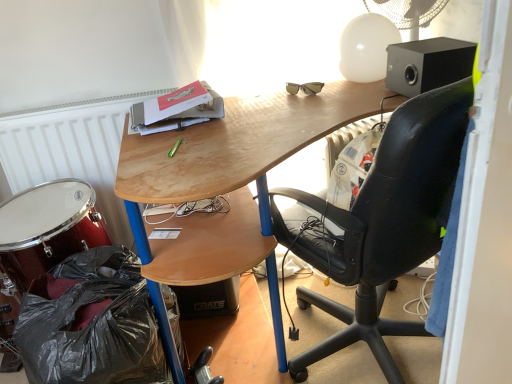
This screenshot has height=384, width=512. Find the location of `shiny red drum at lower left`. shiny red drum at lower left is located at coordinates (48, 228).

This screenshot has width=512, height=384. What do you see at coordinates (91, 323) in the screenshot?
I see `black plastic bag at lower left` at bounding box center [91, 323].

What is the approximate height of white plastic mechanical fan at upper right?

white plastic mechanical fan at upper right is 17.68 centimeters in height.

This screenshot has width=512, height=384. What do you see at coordinates (241, 144) in the screenshot?
I see `wooden desk at upper center` at bounding box center [241, 144].

Describe the element at coordinates (428, 64) in the screenshot. The height and width of the screenshot is (384, 512). I see `matte black speaker at upper right` at that location.

Describe the element at coordinates (381, 223) in the screenshot. The height and width of the screenshot is (384, 512). I see `black leather chair at upper right` at that location.

The height and width of the screenshot is (384, 512). I want to click on shiny red drum at lower left, so pyautogui.click(x=48, y=228).

How many degrees apart are the facing directions of matte black speaker at upper right and wooden desk at upper center?

They differ by 88.8 degrees in their facing directions.

Is matte black speaker at upper right inside the boundaries of wooden desk at upper center, or outside?

matte black speaker at upper right lies outside wooden desk at upper center.

Considering the relative sizes of matte black speaker at upper right and wooden desk at upper center in the image provided, is matte black speaker at upper right thinner than wooden desk at upper center?

Yes.

Which of these two, matte black speaker at upper right or wooden desk at upper center, is smaller?

matte black speaker at upper right.

Who is smaller, black leather chair at upper right or wooden desk at upper center?

black leather chair at upper right is smaller.

You are a GUI agent. You are given a task and a screenshot of the screen. Output one action in this format:
    pyautogui.click(x=<x>, y=<y>)
    Task: Click on the chair in front of the wooden desk at upper center
    This screenshot has height=384, width=512.
    Given the screenshot: What is the action you would take?
    pyautogui.click(x=381, y=223)

Is black leather chair at upper right thinner than wooden desk at upper center?

Indeed, black leather chair at upper right has a lesser width compared to wooden desk at upper center.

From the picture: Is wooden desk at upper center a part of white matte radiator at left?

No, white matte radiator at left does not contain wooden desk at upper center.

Locate an element on the screen. radiator above the wooden desk at upper center (from the image's perspective) is located at coordinates (71, 149).

In the scene shown: How different are the orientations of white matte radiator at left and wooden desk at upper center in degrees?

The facing directions of white matte radiator at left and wooden desk at upper center are 2.38 degrees apart.

This screenshot has width=512, height=384. I want to click on chair to the left of white plastic mechanical fan at upper right, so click(x=381, y=223).

Is white plastic mechanical fan at upper right shorter than black leather chair at upper right?

Indeed, white plastic mechanical fan at upper right has a lesser height compared to black leather chair at upper right.

Can you tell me how much white plastic mechanical fan at upper right and black leather chair at upper right differ in facing direction?

The angular difference between white plastic mechanical fan at upper right and black leather chair at upper right is 103 degrees.

From the image's perspective, between white plastic mechanical fan at upper right and black leather chair at upper right, which one is located above?

white plastic mechanical fan at upper right is shown above in the image.

Measure the distance from white matte radiator at left to white plastic mechanical fan at upper right.

white matte radiator at left and white plastic mechanical fan at upper right are 4.01 feet apart.

Considering the relative positions of white matte radiator at left and white plastic mechanical fan at upper right in the image provided, is white matte radiator at left behind white plastic mechanical fan at upper right?

Yes, white matte radiator at left is further from the viewer.

Based on the photo, from the image's perspective, is white matte radiator at left over white plastic mechanical fan at upper right?

No, from the image's perspective, white matte radiator at left is not over white plastic mechanical fan at upper right.

How different are the orientations of white matte radiator at left and white plastic mechanical fan at upper right in degrees?

They differ by 57.9 degrees in their facing directions.

Is shiny red drum at lower left at the back of matte black speaker at upper right?

No, matte black speaker at upper right is not facing away from shiny red drum at lower left.

In the scene shown: From a real-world perspective, who is located higher, matte black speaker at upper right or shiny red drum at lower left?

In real-world perspective, matte black speaker at upper right is above.

Considering the positions of objects matte black speaker at upper right and shiny red drum at lower left in the image provided, who is more to the left, matte black speaker at upper right or shiny red drum at lower left?

Positioned to the left is shiny red drum at lower left.

Could you tell me if white plastic mechanical fan at upper right is facing matte black speaker at upper right?

Yes, white plastic mechanical fan at upper right is oriented towards matte black speaker at upper right.

From a real-world perspective, who is located higher, white plastic mechanical fan at upper right or matte black speaker at upper right?

white plastic mechanical fan at upper right is physically above.

Between white plastic mechanical fan at upper right and matte black speaker at upper right, which one has less height?

With less height is matte black speaker at upper right.

Choose the correct answer: Is white plastic mechanical fan at upper right inside matte black speaker at upper right or outside it?

white plastic mechanical fan at upper right is not inside matte black speaker at upper right, it's outside.

This screenshot has width=512, height=384. In order to click on desk on the left of matte black speaker at upper right in this screenshot , I will do `click(241, 144)`.

Image resolution: width=512 pixels, height=384 pixels. I want to click on chair that appears on the right of wooden desk at upper center, so click(381, 223).

Which object lies further to the anchor point wooden desk at upper center, white plastic mechanical fan at upper right or shiny red drum at lower left?

white plastic mechanical fan at upper right.

Looking at the image, which one is located closer to white plastic mechanical fan at upper right, black leather chair at upper right or black plastic bag at lower left?

black leather chair at upper right lies closer to white plastic mechanical fan at upper right than the other object.

Estimate the real-world distances between objects in this image. Which object is closer to matte black speaker at upper right, white matte radiator at left or shiny red drum at lower left?

white matte radiator at left.

Estimate the real-world distances between objects in this image. Which object is further from shiny red drum at lower left, matte black speaker at upper right or white plastic mechanical fan at upper right?

Based on the image, white plastic mechanical fan at upper right appears to be further to shiny red drum at lower left.

Considering their positions, is white matte radiator at left positioned closer to white plastic mechanical fan at upper right than black plastic bag at lower left?

The object closer to white plastic mechanical fan at upper right is white matte radiator at left.

Consider the image. When comparing their distances from black plastic bag at lower left, does matte black speaker at upper right or black leather chair at upper right seem closer?

black leather chair at upper right.

Considering their positions, is white matte radiator at left positioned closer to shiny red drum at lower left than black plastic bag at lower left?

Based on the image, black plastic bag at lower left appears to be nearer to shiny red drum at lower left.

Based on their spatial positions, is white plastic mechanical fan at upper right or black plastic bag at lower left closer to white matte radiator at left?

Among the two, black plastic bag at lower left is located nearer to white matte radiator at left.

Identify the location of radiator between shiny red drum at lower left and matte black speaker at upper right in the horizontal direction. The width and height of the screenshot is (512, 384). (71, 149).

Identify the location of desk that lies between white plastic mechanical fan at upper right and black plastic bag at lower left from top to bottom. (241, 144).

Where is `desk between shiny red drum at lower left and white plastic mechanical fan at upper right from left to right`? The height and width of the screenshot is (384, 512). desk between shiny red drum at lower left and white plastic mechanical fan at upper right from left to right is located at coordinates (241, 144).

This screenshot has height=384, width=512. In order to click on desk between white matte radiator at left and matte black speaker at upper right in this screenshot , I will do `click(241, 144)`.